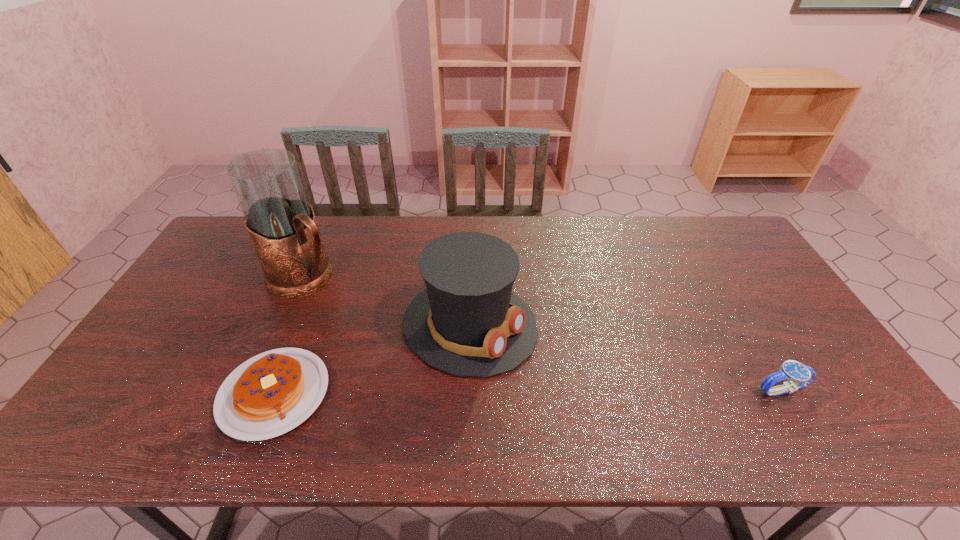
Image resolution: width=960 pixels, height=540 pixels. In order to click on the shortest object in this screenshot , I will do `click(270, 394)`.

The width and height of the screenshot is (960, 540). I want to click on watch, so click(x=799, y=375).

The height and width of the screenshot is (540, 960). Find the location of `the third tallest object`. the third tallest object is located at coordinates (799, 375).

Image resolution: width=960 pixels, height=540 pixels. What are the coordinates of `the tallest object` in the screenshot? It's located at (281, 224).

I want to click on the third shortest object, so click(468, 323).

The image size is (960, 540). I want to click on the second object from right to left, so click(468, 323).

You are a GUI agent. You are given a task and a screenshot of the screen. Output one action in this format:
    pyautogui.click(x=<x>, y=<y>)
    Task: Click on the free spot located 0.150m on the right of the shortest object
    The height and width of the screenshot is (540, 960).
    Given the screenshot: What is the action you would take?
    pyautogui.click(x=389, y=394)

Locate an element on the screen. vacant region located 0.240m on the left of the second shortest object is located at coordinates (658, 390).

The width and height of the screenshot is (960, 540). In order to click on vacant space situated with the handle on the side of the tallest object in this screenshot , I will do `click(350, 305)`.

Identify the location of blank space located 0.090m with the handle on the side of the tallest object. The height and width of the screenshot is (540, 960). (350, 305).